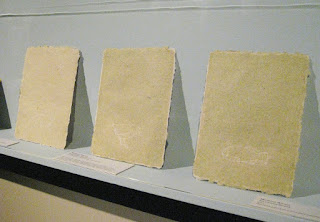
The height and width of the screenshot is (222, 320). I want to click on tan flooring, so click(x=16, y=208).